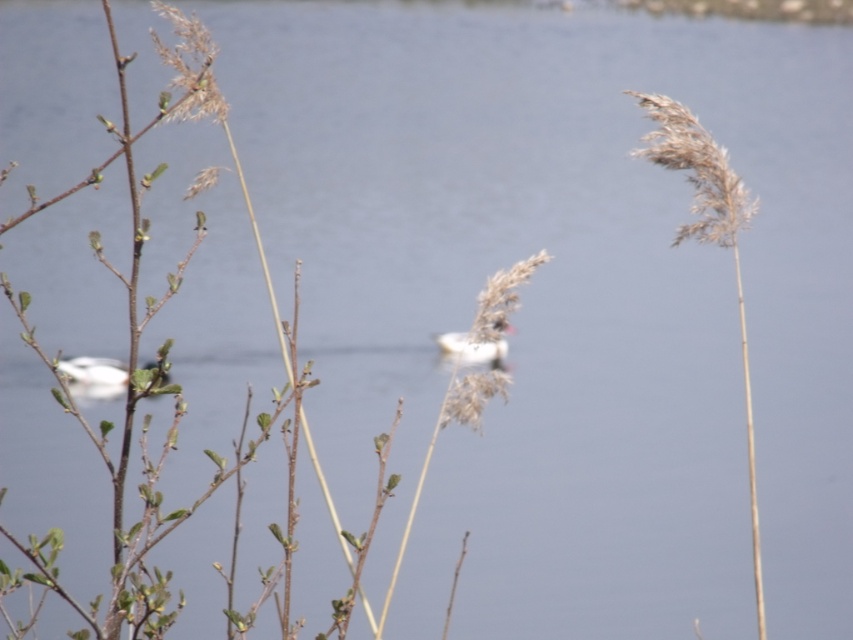
Between white matte boat at left and white fluffy bird at center, which one has more height?

white fluffy bird at center is taller.

How distant is white matte boat at left from white fluffy bird at center?

white matte boat at left is 4.71 feet from white fluffy bird at center.

Which is behind, point (164, 378) or point (468, 362)?

The point (468, 362) is behind.

This screenshot has height=640, width=853. Identify the location of white matte boat at left. (94, 371).